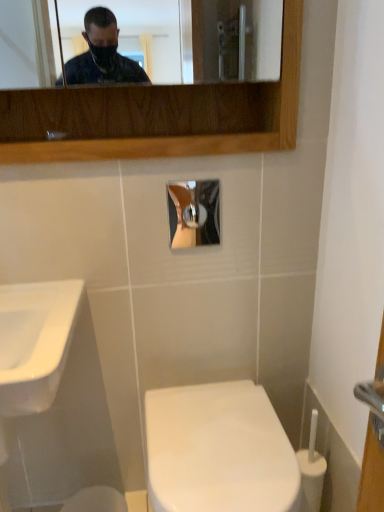
Question: Does point (48, 320) appear closer or farther from the camera than point (51, 137)?

Choices:
 (A) closer
 (B) farther

Answer: (A)

Question: Considering the relative positions of white glossy sink at left and matte silver faucet at upper center in the image provided, is white glossy sink at left to the left or to the right of matte silver faucet at upper center?

Choices:
 (A) right
 (B) left

Answer: (B)

Question: Estimate the real-world distances between objects in this image. Which object is farther from the matte silver faucet at upper center?

Choices:
 (A) white glossy sink at left
 (B) white glossy toilet bowl at lower center
 (C) white glossy toilet at center

Answer: (B)

Question: Which object is positioned farthest from the white glossy sink at left?

Choices:
 (A) matte silver faucet at upper center
 (B) white glossy toilet at center
 (C) white glossy toilet bowl at lower center

Answer: (C)